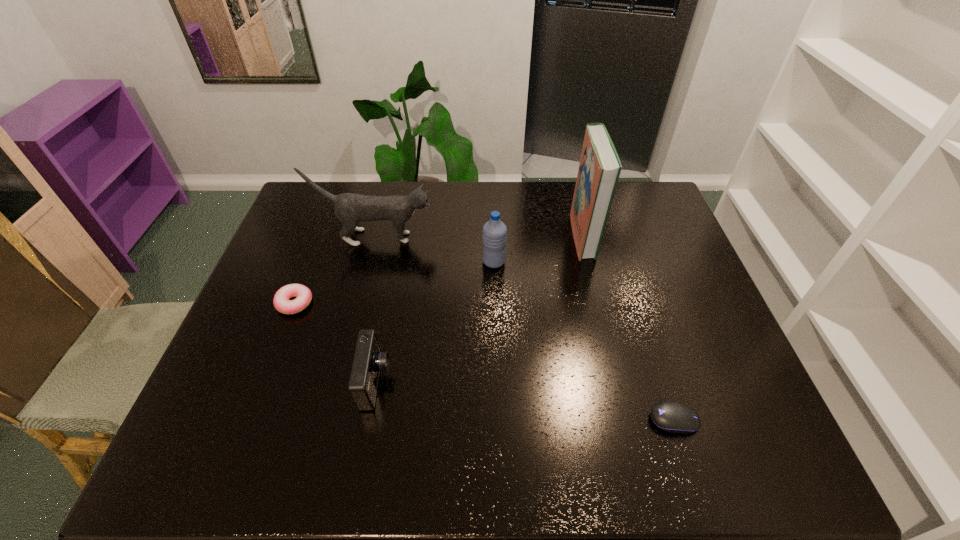
Locate an element on the screen. Image resolution: width=960 pixels, height=540 pixels. hardback book is located at coordinates (600, 167).

Locate an element on the screen. This screenshot has width=960, height=540. the tallest object is located at coordinates (600, 167).

Find the location of `the second tallest object`. the second tallest object is located at coordinates (350, 208).

Find the location of `the third object from right to left`. the third object from right to left is located at coordinates (494, 231).

Identify the location of water bottle. Image resolution: width=960 pixels, height=540 pixels. (494, 231).

Locate an element on the screen. This screenshot has width=960, height=540. the fourth tallest object is located at coordinates coord(369,360).

Locate an element on the screen. The width and height of the screenshot is (960, 540). doughnut is located at coordinates (282, 303).

Locate an element on the screen. The width and height of the screenshot is (960, 540). computer mouse is located at coordinates (673, 417).

This screenshot has width=960, height=540. Identify the location of free space located on the cover of the hardback book. (467, 236).

This screenshot has height=540, width=960. Find the location of `vacant space situated 0.210m on the cover of the hardback book`. vacant space situated 0.210m on the cover of the hardback book is located at coordinates (507, 236).